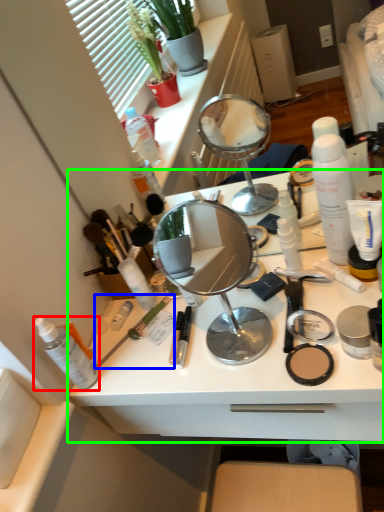
Question: Which is farther away from toiletry (highlighted by a red box)? brush (highlighted by a blue box) or desk (highlighted by a green box)?

Choices:
 (A) brush
 (B) desk

Answer: (B)